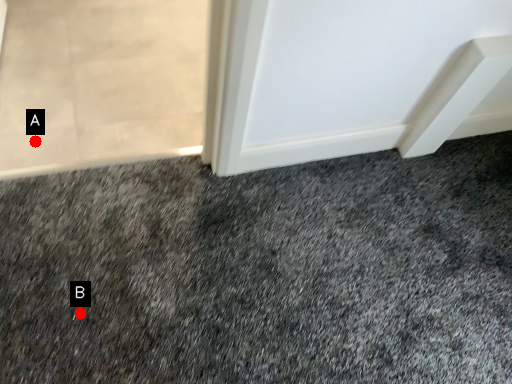
Question: Two points are circled on the image, labeled by A and B beside each circle. Which of the following is the closest to the observer?

Choices:
 (A) A is closer
 (B) B is closer

Answer: (B)